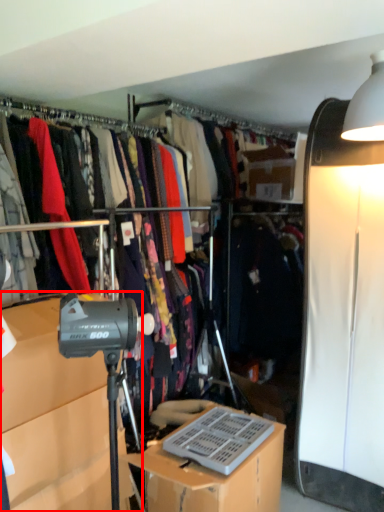
Question: From the image's perspective, where is cabinetry (annotated by the red box) located in relation to desk in the image?

Choices:
 (A) below
 (B) above

Answer: (B)